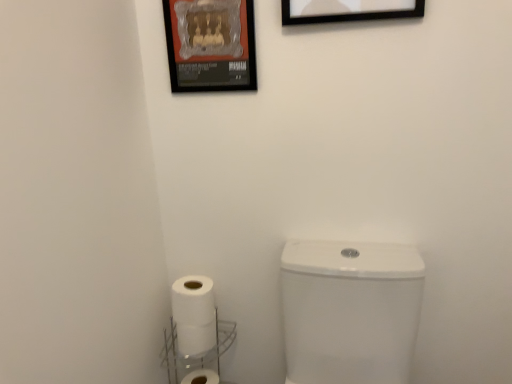
Question: Is black matte picture frame at upper center, which appears as the 1th picture frame when viewed from the right, at the left side of metallic poster at upper center, the 2th picture frame from the front?

Choices:
 (A) no
 (B) yes

Answer: (A)

Question: Would you say black matte picture frame at upper center, positioned as the first picture frame in front-to-back order, contains metallic poster at upper center, which ranks as the 1th picture frame in back-to-front order?

Choices:
 (A) no
 (B) yes

Answer: (A)

Question: From the image's perspective, is black matte picture frame at upper center, the second picture frame when ordered from back to front, located beneath metallic poster at upper center, positioned as the second picture frame in right-to-left order?

Choices:
 (A) no
 (B) yes

Answer: (A)

Question: Considering the relative sizes of black matte picture frame at upper center, which is the second picture frame in left-to-right order, and metallic poster at upper center, the 2th picture frame from the front, in the image provided, is black matte picture frame at upper center, which is the second picture frame in left-to-right order, taller than metallic poster at upper center, the 2th picture frame from the front,?

Choices:
 (A) yes
 (B) no

Answer: (A)

Question: Is black matte picture frame at upper center, which is the second picture frame in left-to-right order, smaller than metallic poster at upper center, which ranks as the 1th picture frame in back-to-front order?

Choices:
 (A) yes
 (B) no

Answer: (B)

Question: Is black matte picture frame at upper center, the second picture frame when ordered from back to front, closer to the viewer compared to metallic poster at upper center, the 2th picture frame from the front?

Choices:
 (A) no
 (B) yes

Answer: (B)

Question: Does metallic poster at upper center, which ranks as the 1th picture frame in back-to-front order, lie in front of white matte toilet paper at lower left, the first toilet paper ordered from the bottom?

Choices:
 (A) yes
 (B) no

Answer: (A)

Question: Can you confirm if metallic poster at upper center, positioned as the second picture frame in right-to-left order, is taller than white matte toilet paper at lower left, the 2th toilet paper positioned from the top?

Choices:
 (A) no
 (B) yes

Answer: (B)

Question: Is metallic poster at upper center, the 2th picture frame from the front, thinner than white matte toilet paper at lower left, the 2th toilet paper positioned from the top?

Choices:
 (A) yes
 (B) no

Answer: (A)

Question: Can you confirm if metallic poster at upper center, acting as the first picture frame starting from the left, is positioned to the left of white matte toilet paper at lower left, the first toilet paper ordered from the bottom?

Choices:
 (A) no
 (B) yes

Answer: (A)

Question: Is metallic poster at upper center, acting as the first picture frame starting from the left, bigger than white matte toilet paper at lower left, the 2th toilet paper positioned from the top?

Choices:
 (A) no
 (B) yes

Answer: (A)

Question: Is metallic poster at upper center, acting as the first picture frame starting from the left, turned away from white matte toilet paper at lower left, the 2th toilet paper positioned from the top?

Choices:
 (A) yes
 (B) no

Answer: (B)

Question: Considering the relative sizes of white glossy toilet at lower right and black matte picture frame at upper center, positioned as the first picture frame in front-to-back order, in the image provided, is white glossy toilet at lower right thinner than black matte picture frame at upper center, positioned as the first picture frame in front-to-back order,?

Choices:
 (A) no
 (B) yes

Answer: (A)